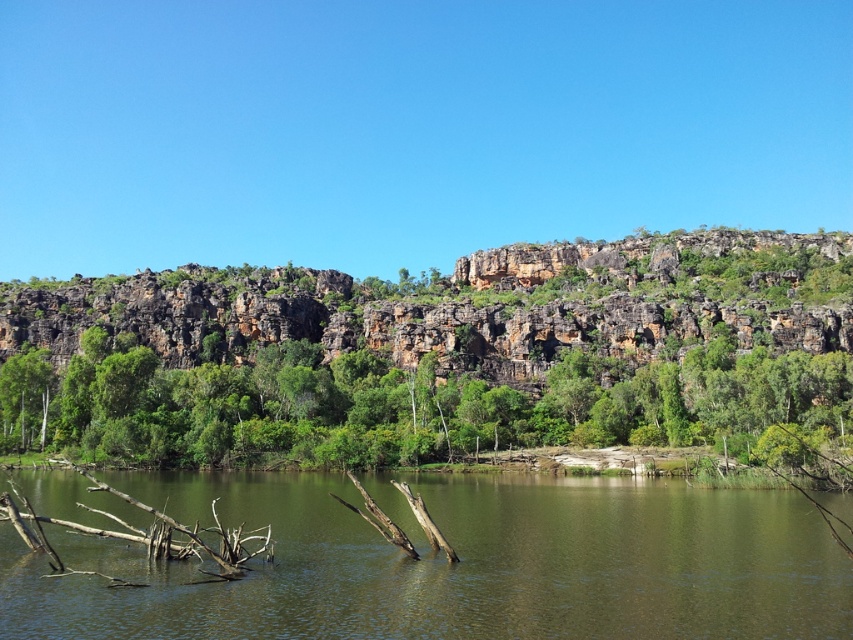
Question: Can you confirm if greenish-brown water at center is positioned below green leafy tree at center?

Choices:
 (A) no
 (B) yes

Answer: (B)

Question: Which point is farther to the camera?

Choices:
 (A) (666, 374)
 (B) (163, 486)

Answer: (A)

Question: Can you confirm if greenish-brown water at center is positioned below green leafy tree at center?

Choices:
 (A) no
 (B) yes

Answer: (B)

Question: Can you confirm if greenish-brown water at center is positioned below green leafy tree at center?

Choices:
 (A) yes
 (B) no

Answer: (A)

Question: Which of the following is the closest to the observer?

Choices:
 (A) green leafy tree at center
 (B) greenish-brown water at center

Answer: (B)

Question: Which object is farther from the camera taking this photo?

Choices:
 (A) greenish-brown water at center
 (B) green leafy tree at center

Answer: (B)